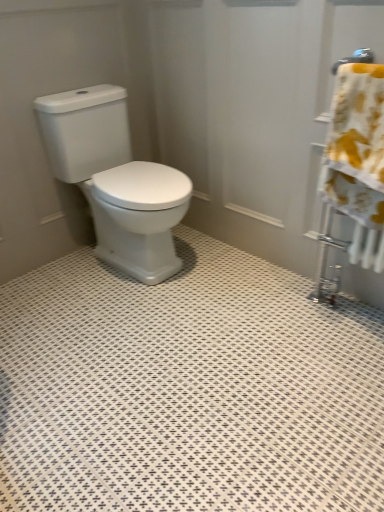
Question: Is yellow floral fabric at right taller than white glossy toilet at center?

Choices:
 (A) yes
 (B) no

Answer: (B)

Question: Is yellow floral fabric at right completely or partially outside of white glossy toilet at center?

Choices:
 (A) yes
 (B) no

Answer: (A)

Question: From the image's perspective, would you say yellow floral fabric at right is positioned over white glossy toilet at center?

Choices:
 (A) yes
 (B) no

Answer: (B)

Question: Is yellow floral fabric at right aimed at white glossy toilet at center?

Choices:
 (A) no
 (B) yes

Answer: (A)

Question: Considering the relative sizes of yellow floral fabric at right and white glossy toilet at center in the image provided, is yellow floral fabric at right smaller than white glossy toilet at center?

Choices:
 (A) no
 (B) yes

Answer: (B)

Question: From the image's perspective, is yellow floral fabric at right beneath white glossy toilet at center?

Choices:
 (A) no
 (B) yes

Answer: (B)

Question: Is white glossy toilet at center to the left of yellow floral fabric at right from the viewer's perspective?

Choices:
 (A) no
 (B) yes

Answer: (B)

Question: From a real-world perspective, is white glossy toilet at center under yellow floral fabric at right?

Choices:
 (A) yes
 (B) no

Answer: (A)

Question: Is the depth of white glossy toilet at center greater than that of yellow floral fabric at right?

Choices:
 (A) yes
 (B) no

Answer: (A)

Question: Considering the relative sizes of white glossy toilet at center and yellow floral fabric at right in the image provided, is white glossy toilet at center thinner than yellow floral fabric at right?

Choices:
 (A) yes
 (B) no

Answer: (B)

Question: Is white glossy toilet at center bigger than yellow floral fabric at right?

Choices:
 (A) yes
 (B) no

Answer: (A)

Question: Can you confirm if white glossy toilet at center is positioned to the right of yellow floral fabric at right?

Choices:
 (A) yes
 (B) no

Answer: (B)

Question: Relative to yellow floral fabric at right, is white glossy toilet at center in front or behind?

Choices:
 (A) front
 (B) behind

Answer: (B)